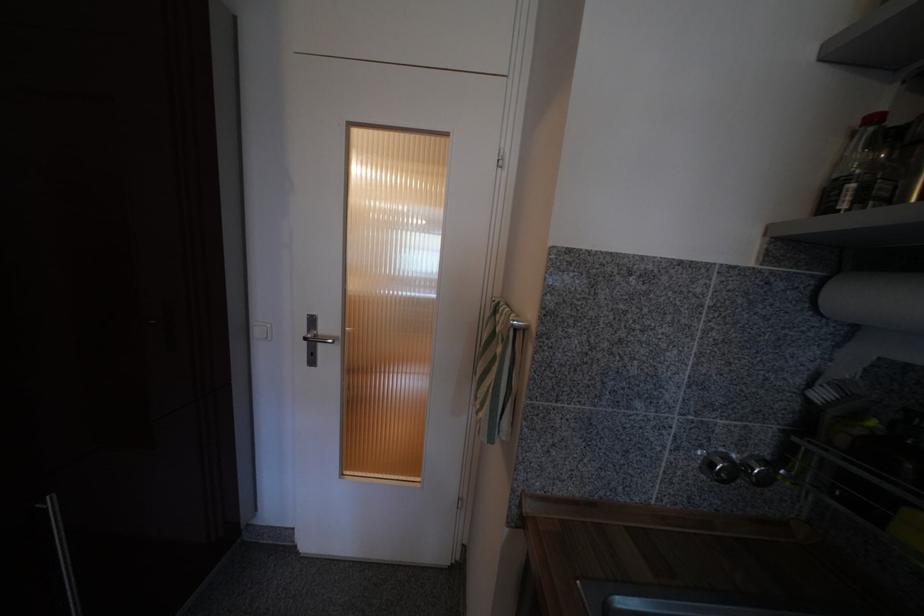
This screenshot has height=616, width=924. Describe the element at coordinates (873, 118) in the screenshot. I see `a red bottle cap` at that location.